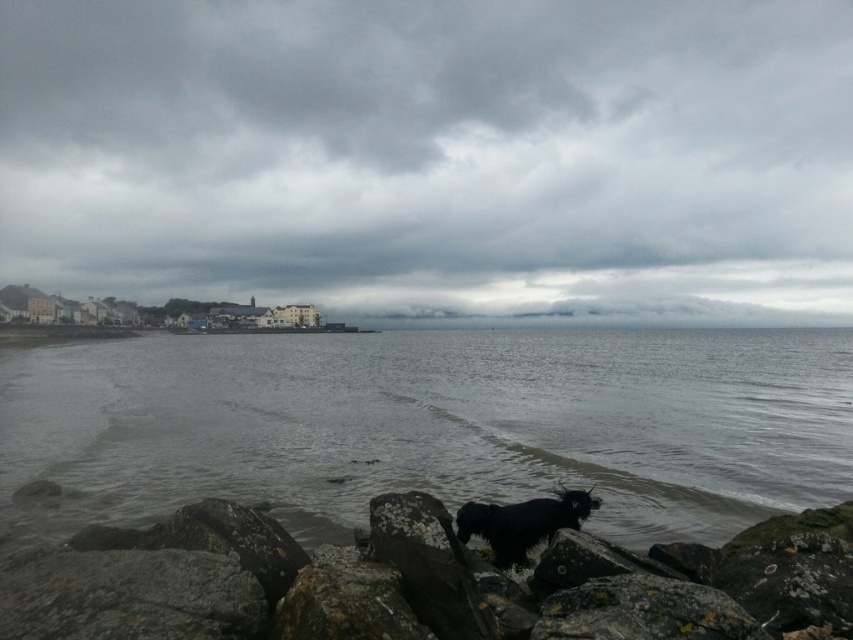
Between cloudy sky at upper center and gray matte water at center, which one appears on the right side from the viewer's perspective?

From the viewer's perspective, gray matte water at center appears more on the right side.

Is cloudy sky at upper center shorter than gray matte water at center?

In fact, cloudy sky at upper center may be taller than gray matte water at center.

Describe the element at coordinates (433, 154) in the screenshot. The height and width of the screenshot is (640, 853). I see `cloudy sky at upper center` at that location.

The image size is (853, 640). Identify the location of cloudy sky at upper center. (433, 154).

Does point (41, 77) come in front of point (560, 552)?

That is False.

Based on the photo, who is more distant from viewer, (x=341, y=234) or (x=764, y=634)?

Positioned behind is point (x=341, y=234).

What do you see at coordinates (433, 154) in the screenshot? I see `cloudy sky at upper center` at bounding box center [433, 154].

You are a GUI agent. You are given a task and a screenshot of the screen. Output one action in this format:
    pyautogui.click(x=<x>, y=<y>)
    Task: Click on the cloudy sky at upper center
    The width and height of the screenshot is (853, 640).
    Given the screenshot: What is the action you would take?
    pyautogui.click(x=433, y=154)

Between point (231, 125) and point (467, 540), which one is positioned behind?

The point (231, 125) is behind.

Measure the distance between cloudy sky at upper center and camera.

249.38 meters

This screenshot has height=640, width=853. Describe the element at coordinates (433, 154) in the screenshot. I see `cloudy sky at upper center` at that location.

This screenshot has width=853, height=640. What are the coordinates of `cloudy sky at upper center` in the screenshot? It's located at (433, 154).